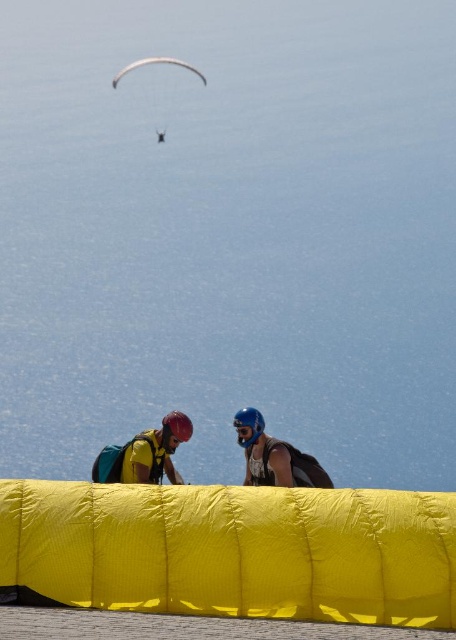
You are a drone operator trying to locate the yellow fabric parachute at center. According to the coordinates provided, where should you direct your drone to find it?

The yellow fabric parachute at center is located at coordinates point (232, 552).

You are a paragliding instructor assessing the equipment. You see the yellow fabric parachute at lower center and the white glossy parachute at upper center. Which parachute has a smaller width?

The yellow fabric parachute at lower center is thinner than the white glossy parachute at upper center, so the yellow fabric parachute at lower center has a smaller width.

You are a safety inspector checking the distance between the yellow fabric parachute at lower center and the white glossy parachute at upper center. The safety regulation requires a minimum distance of 10 meters between them. Is the current distance compliant with the regulation?

The distance between the yellow fabric parachute at lower center and the white glossy parachute at upper center is 15.07 meters, which exceeds the required 10 meters, so it is compliant with the safety regulation.